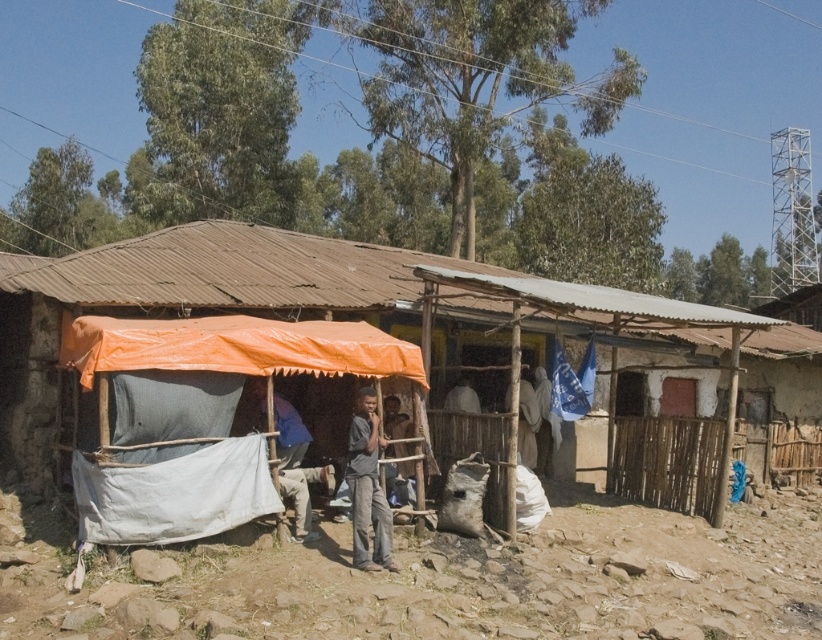
Is gray matte shirt at center below dark gray fabric at center?

Correct, gray matte shirt at center is located below dark gray fabric at center.

Does gray matte shirt at center appear on the left side of dark gray fabric at center?

Yes, gray matte shirt at center is to the left of dark gray fabric at center.

Between point (377, 484) and point (459, 396), which one is positioned in front?

Point (377, 484)

Where is `gray matte shirt at center`? This screenshot has width=822, height=640. gray matte shirt at center is located at coordinates (367, 486).

Is point (525, 429) in front of point (538, 433)?

Yes, point (525, 429) is closer to viewer.

Identify the location of light brown wooden pole at center. The width and height of the screenshot is (822, 640). (527, 420).

Find the location of a particular element. light brown wooden pole at center is located at coordinates (527, 420).

Can you confirm if orange tarpaulin tent at center is taller than light brown wooden pole at center?

Yes, orange tarpaulin tent at center is taller than light brown wooden pole at center.

Where is `orange tarpaulin tent at center`? orange tarpaulin tent at center is located at coordinates (231, 349).